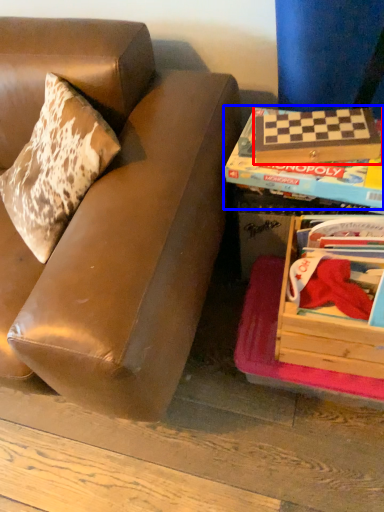
Question: Which point is further to the camera, paperback book (highlighted by a red box) or paperback book (highlighted by a blue box)?

Choices:
 (A) paperback book
 (B) paperback book

Answer: (A)